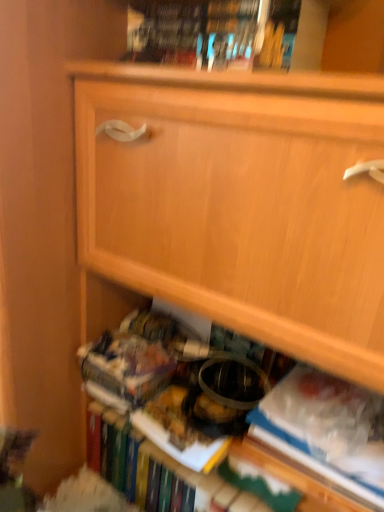
Question: From the image's perspective, is hardcover book at upper center located above or below white paper at lower right?

Choices:
 (A) above
 (B) below

Answer: (A)

Question: In the image, is hardcover book at upper center on the left side or the right side of white paper at lower right?

Choices:
 (A) left
 (B) right

Answer: (A)

Question: Considering the positions of point (221, 9) and point (336, 467), is point (221, 9) closer or farther from the camera than point (336, 467)?

Choices:
 (A) closer
 (B) farther

Answer: (A)

Question: In terms of height, does white paper at lower right look taller or shorter compared to hardcover book at upper center?

Choices:
 (A) short
 (B) tall

Answer: (B)

Question: In the image, is white paper at lower right positioned in front of or behind hardcover book at upper center?

Choices:
 (A) front
 (B) behind

Answer: (B)

Question: Based on their sizes in the image, would you say white paper at lower right is bigger or smaller than hardcover book at upper center?

Choices:
 (A) big
 (B) small

Answer: (B)

Question: Is white paper at lower right inside or outside of hardcover book at upper center?

Choices:
 (A) inside
 (B) outside

Answer: (B)